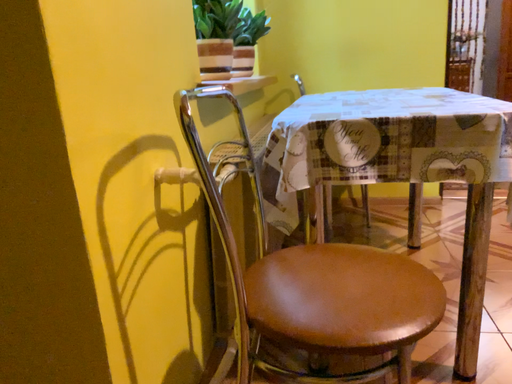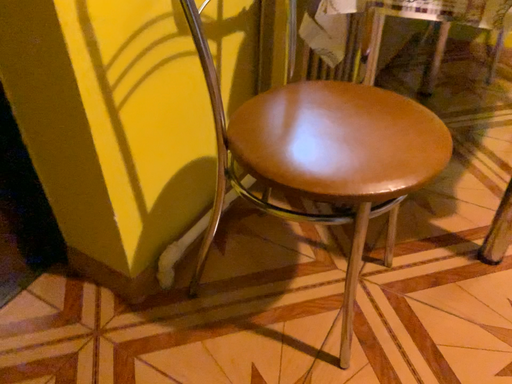
Question: Which way did the camera rotate in the video?

Choices:
 (A) rotated left
 (B) rotated right

Answer: (A)